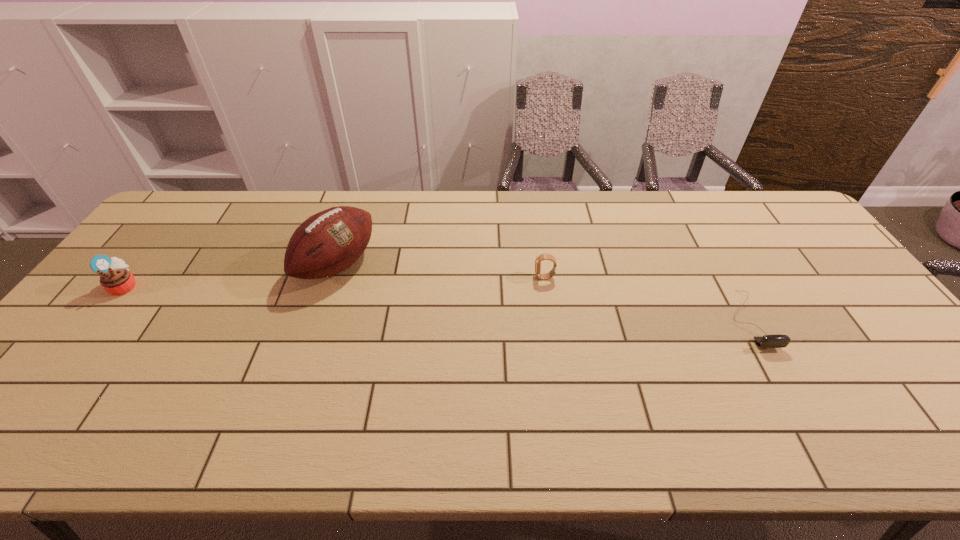
Find the location of a particular element. free space that is in between the webcam and the muffin is located at coordinates (437, 303).

Identify which object is located as the second nearest to the muffin. Please provide its 2D coordinates. Your answer should be formatted as a tuple, i.e. [(x, y)], where the tuple contains the x and y coordinates of a point satisfying the conditions above.

[(545, 256)]

The image size is (960, 540). In order to click on object identified as the closest to the webcam in this screenshot , I will do (545, 256).